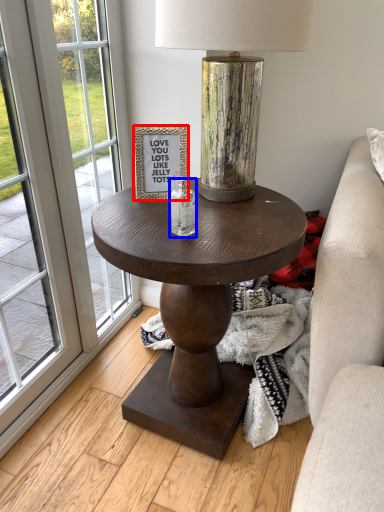
Question: Which point is further to the camera, picture frame (highlighted by a red box) or candle holder (highlighted by a blue box)?

Choices:
 (A) picture frame
 (B) candle holder

Answer: (A)